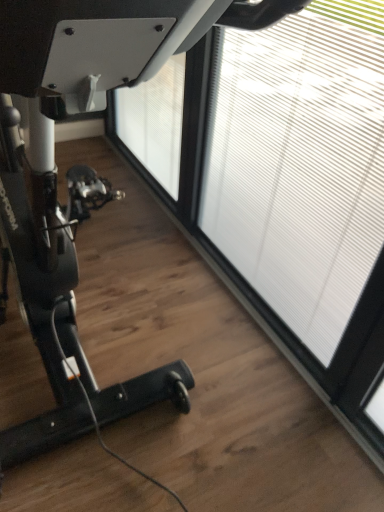
Locate an element on the screen. The width and height of the screenshot is (384, 512). white matte window at right is located at coordinates (300, 163).

Describe the element at coordinates (300, 163) in the screenshot. This screenshot has height=512, width=384. I see `white matte window at right` at that location.

Locate an element on the screen. white matte window at right is located at coordinates (300, 163).